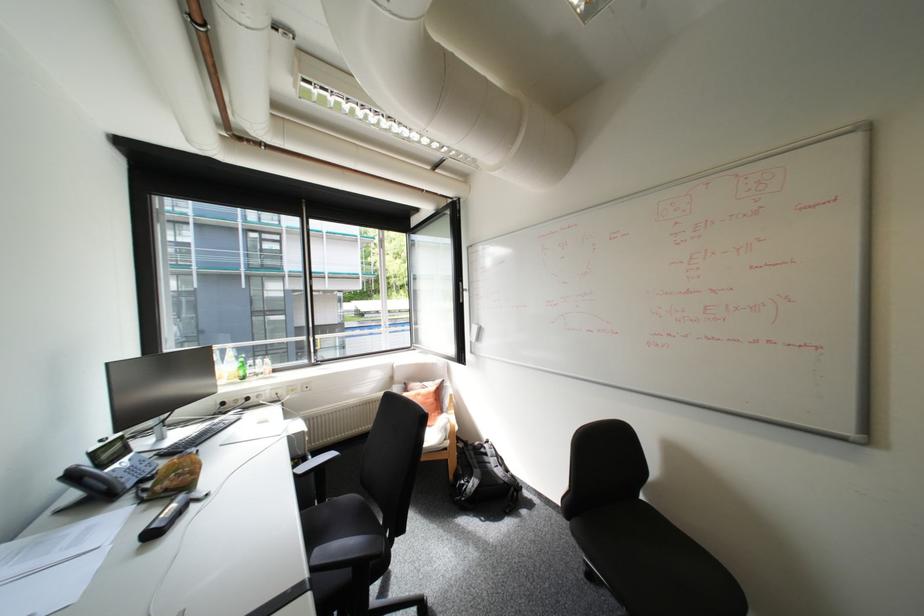
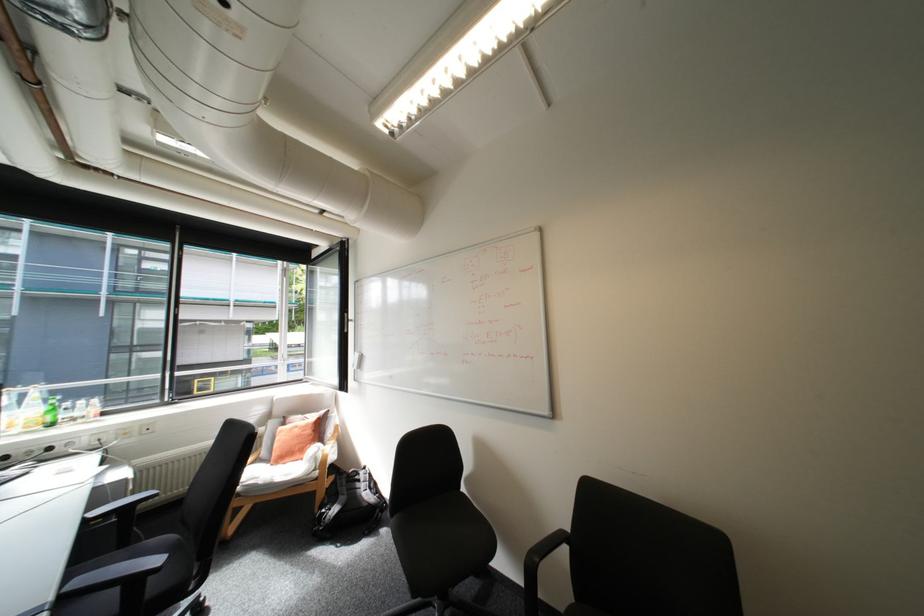
Locate, in the second image, the point that corresponds to the point at 248,365 in the first image.

(55, 408)